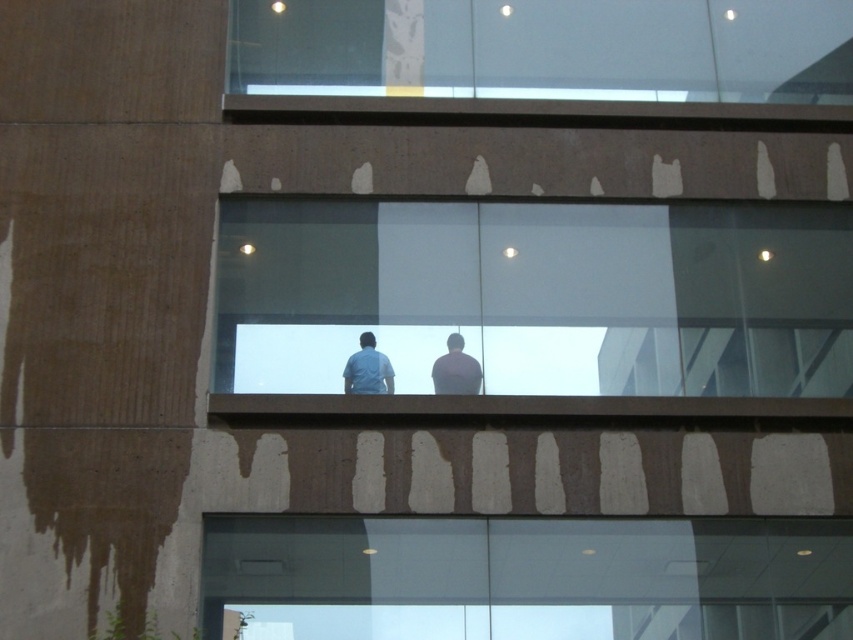
Question: Is transparent glass window at lower center thinner than smooth gray shirt at center?

Choices:
 (A) no
 (B) yes

Answer: (A)

Question: Can you confirm if transparent glass window at center is positioned above light blue shirt at center?

Choices:
 (A) yes
 (B) no

Answer: (A)

Question: Among these objects, which one is farthest from the camera?

Choices:
 (A) transparent glass window at lower center
 (B) smooth gray shirt at center
 (C) light blue shirt at center

Answer: (B)

Question: Which object appears farthest from the camera in this image?

Choices:
 (A) light blue shirt at center
 (B) transparent glass window at lower center
 (C) transparent glass window at center
 (D) smooth gray shirt at center

Answer: (D)

Question: Among these points, which one is farthest from the camera?

Choices:
 (A) click(450, 355)
 (B) click(616, 358)

Answer: (B)

Question: Is transparent glass window at center behind smooth gray shirt at center?

Choices:
 (A) no
 (B) yes

Answer: (A)